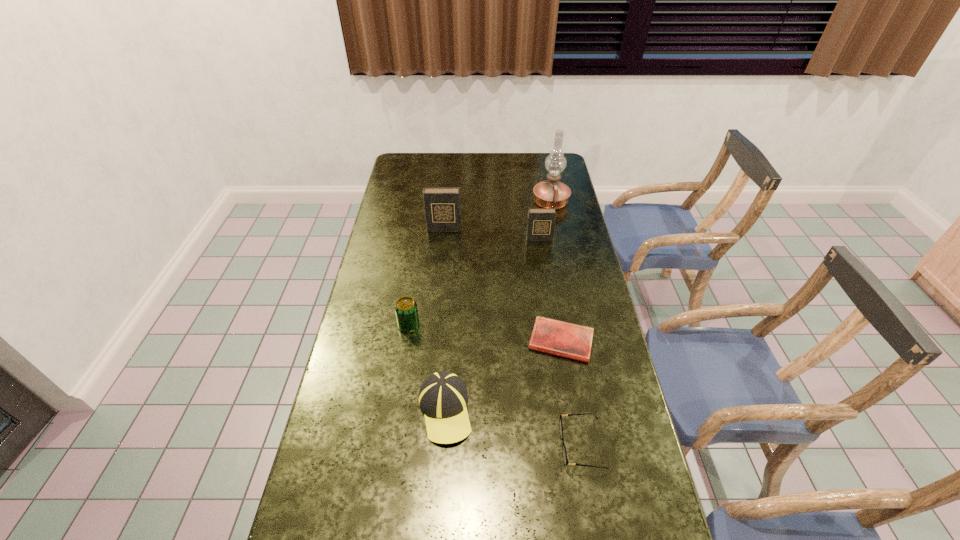
The image size is (960, 540). In order to click on spectacles in this screenshot , I will do `click(564, 453)`.

Locate an element on the screen. The image size is (960, 540). the shortest diary is located at coordinates [551, 336].

Image resolution: width=960 pixels, height=540 pixels. I want to click on red diary, so click(551, 336).

Locate an element on the screen. The height and width of the screenshot is (540, 960). blank space located on the front of the oil lamp is located at coordinates (561, 254).

This screenshot has width=960, height=540. Find the location of `blank space located on the front cover of the farther dark diary`. blank space located on the front cover of the farther dark diary is located at coordinates (440, 270).

The height and width of the screenshot is (540, 960). I want to click on free space located 0.080m on the front cover of the fifth nearest object, so click(x=541, y=255).

Where is `free spot located 0.110m on the back of the beer can`? The height and width of the screenshot is (540, 960). free spot located 0.110m on the back of the beer can is located at coordinates (414, 293).

You are a GUI agent. You are given a task and a screenshot of the screen. Output one action in this format:
    pyautogui.click(x=<x>, y=<y>)
    Task: Click on the vacant space located 0.060m with the brim of the black baseball cap facing forward
    
    Given the screenshot: What is the action you would take?
    pyautogui.click(x=441, y=471)

I want to click on blank space located on the front-facing side of the spectacles, so click(521, 446).

Where is `vacant space situated 0.150m on the front-facing side of the spectacles`? vacant space situated 0.150m on the front-facing side of the spectacles is located at coordinates (502, 446).